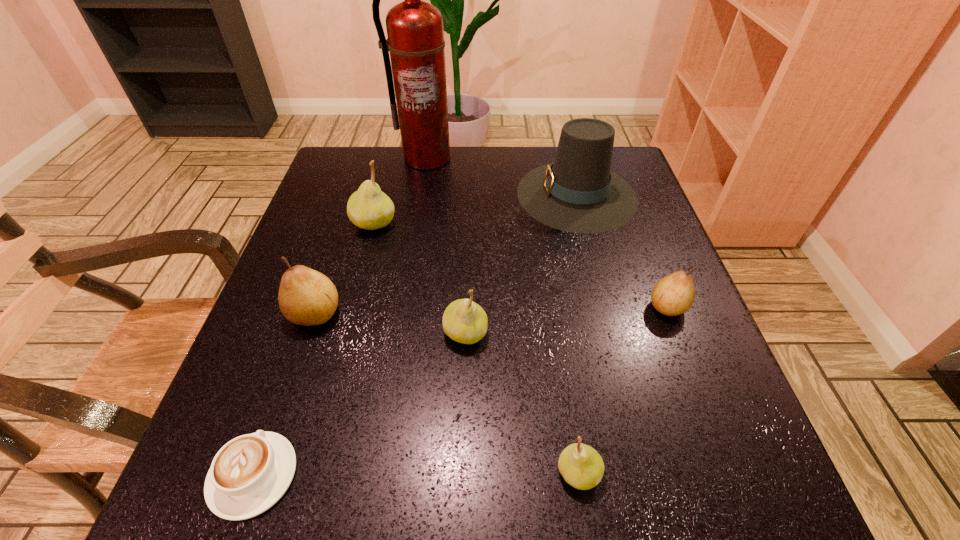
Locate an element on the screen. This screenshot has height=540, width=960. vacant space that satisfies the following two spatial constraints: 1. on the side of the right brown pear with the handle and hose; 2. on the right side of the tallest object is located at coordinates (402, 307).

Locate an element on the screen. This screenshot has height=540, width=960. free space that satisfies the following two spatial constraints: 1. with the handle on the right side of the right brown pear; 2. on the left side of the cappuccino is located at coordinates (311, 307).

Where is `free point that satisfies the following two spatial constraints: 1. on the side of the second farthest green pear with the handle and hose; 2. on the left side of the fire extinguisher`? free point that satisfies the following two spatial constraints: 1. on the side of the second farthest green pear with the handle and hose; 2. on the left side of the fire extinguisher is located at coordinates (398, 333).